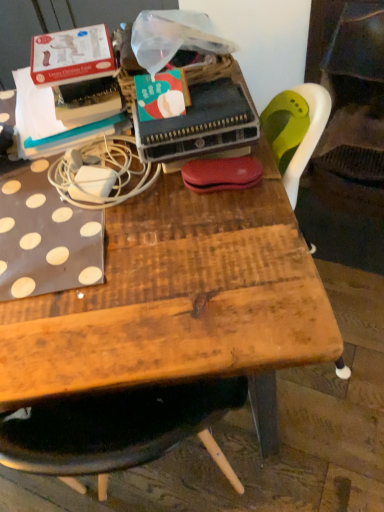
What are the coordinates of `free point to the left of white matte power adapter at upper left` in the screenshot? It's located at (23, 193).